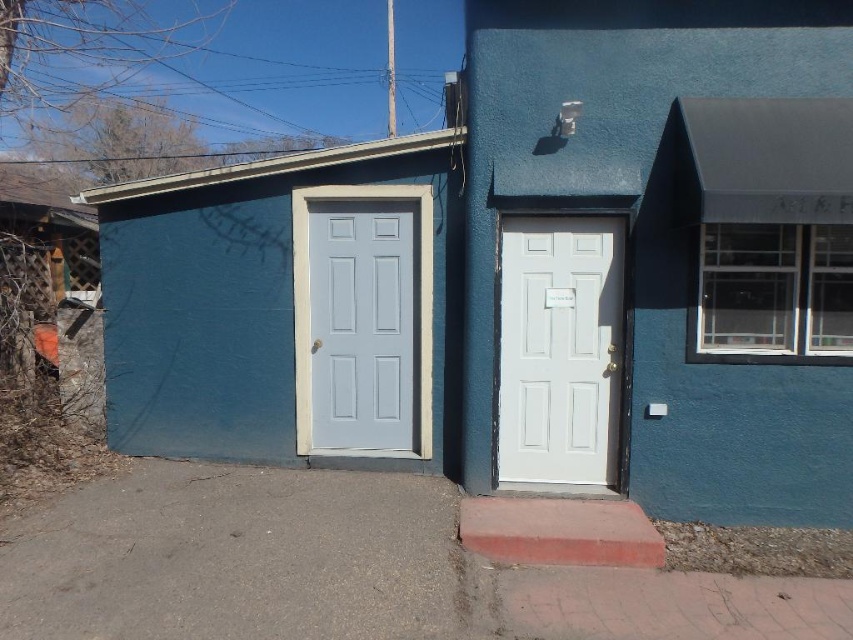
Identify the location of white matte door at center. (560, 349).

Is point (601, 435) closer to camera compared to point (409, 228)?

Yes.

Identify the location of white matte door at center. The image size is (853, 640). (560, 349).